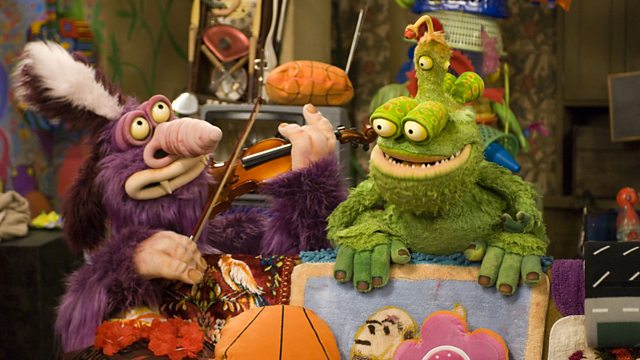
I want to click on blackboard, so click(429, 291).